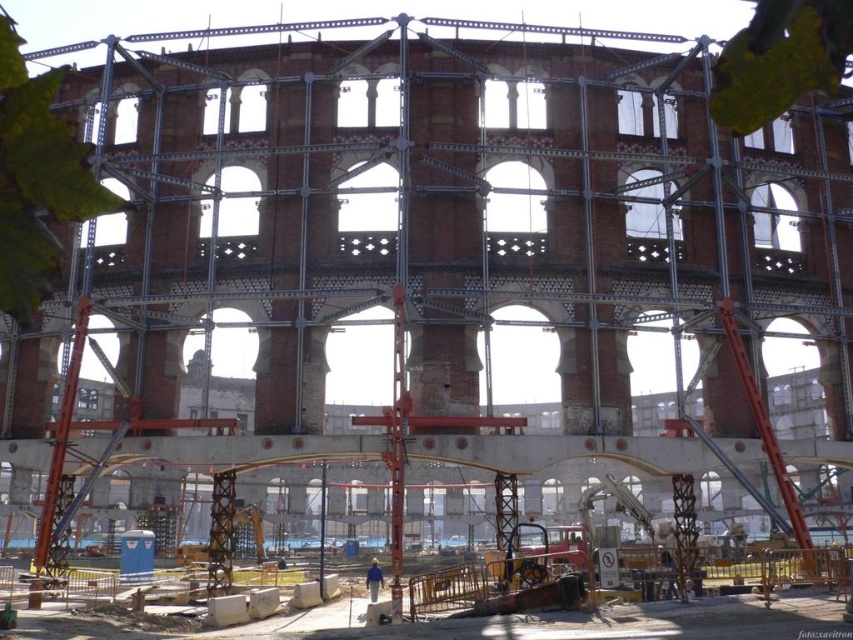
You are a construction inspector standing at the entrance of the site. You notice the rustic wood construction site at lower center and the blue fabric construction worker at center. Which object is nearer to your current position?

The rustic wood construction site at lower center is closer to the viewer than the blue fabric construction worker at center, so the rustic wood construction site at lower center is nearer to your current position.

You are a safety inspector visiting the construction site. You need to ensure that the blue fabric construction worker at center has enough space to move around safely. Considering the size of the rustic wood construction site at lower center, do you think there is sufficient space for the worker to move freely?

The rustic wood construction site at lower center is larger in size than the blue fabric construction worker at center, so there is sufficient space for the worker to move freely around the site.